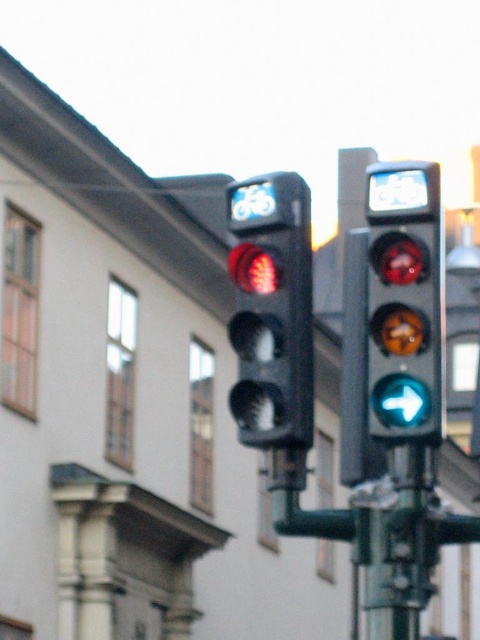
Does matte black traffic light at center have a lesser width compared to matte glass traffic light at center?

Correct, matte black traffic light at center's width is less than matte glass traffic light at center's.

How far apart are matte black traffic light at center and matte glass traffic light at center?

A distance of 1.22 meters exists between matte black traffic light at center and matte glass traffic light at center.

Is point (244, 253) farther from viewer compared to point (379, 396)?

Yes, it is behind point (379, 396).

Locate an element on the screen. Image resolution: width=480 pixels, height=640 pixels. matte black traffic light at center is located at coordinates (272, 310).